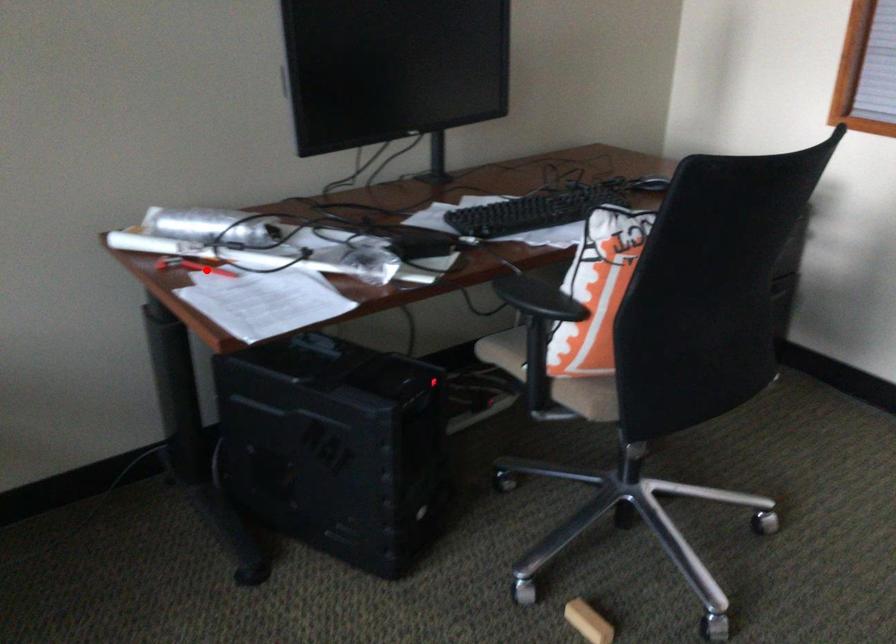
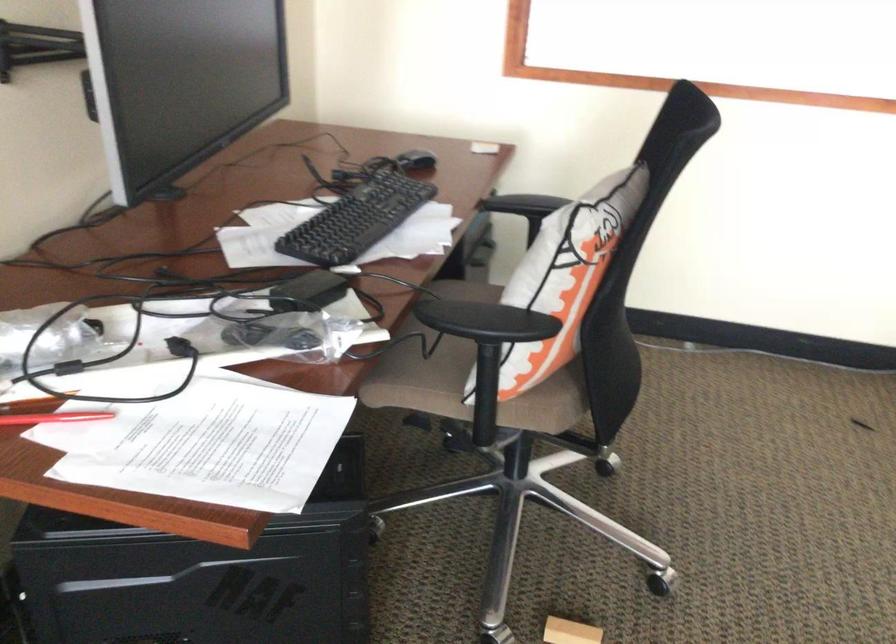
Question: A red point is marked in image1. In image2, is the corresponding 3D point closer to the camera or farther? Reply with the corresponding letter.

Choices:
 (A) The corresponding 3D point is closer.
 (B) The corresponding 3D point is farther.

Answer: (A)